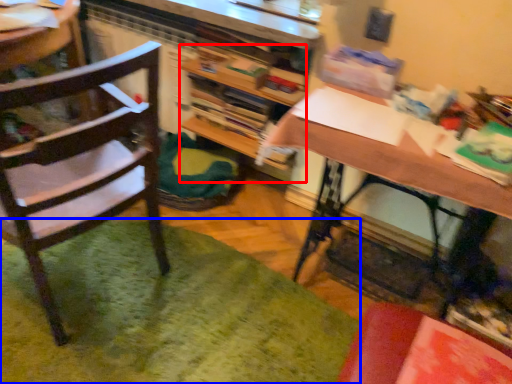
Question: Which point is closer to the camera, bookshelf (highlighted by a red box) or mat (highlighted by a blue box)?

Choices:
 (A) bookshelf
 (B) mat

Answer: (B)